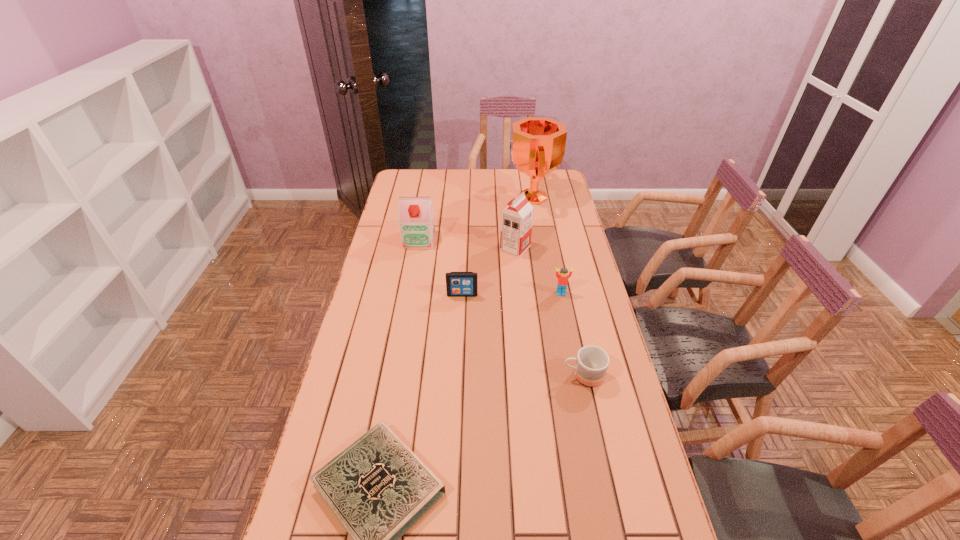
Find the location of `object that is at the far edge`. object that is at the far edge is located at coordinates (537, 147).

Locate an element on the screen. object present at the left edge is located at coordinates pyautogui.click(x=416, y=216).

Find the location of a particular element. This screenshot has width=960, height=540. award that is at the right edge is located at coordinates (537, 147).

Where is `Lego at the right edge`? Image resolution: width=960 pixels, height=540 pixels. Lego at the right edge is located at coordinates (562, 282).

Image resolution: width=960 pixels, height=540 pixels. I want to click on mug positioned at the right edge, so click(592, 362).

Find the location of `object located at the far right corner`. object located at the far right corner is located at coordinates (537, 147).

You are a GUI agent. You are given a task and a screenshot of the screen. Output one action in this format:
    pyautogui.click(x=<x>, y=<y>)
    Task: Click on the vacant space at the far edge of the desktop
    This screenshot has width=960, height=540.
    Given the screenshot: What is the action you would take?
    pyautogui.click(x=443, y=180)

Find the location of a particular element. This screenshot has height=540, width=960. free spot at the left edge of the desktop is located at coordinates (409, 278).

Identify the location of vacant space at the right edge of the desktop. (573, 381).

Find the location of a particular element. vacant area between the iPod and the Lego is located at coordinates (512, 294).